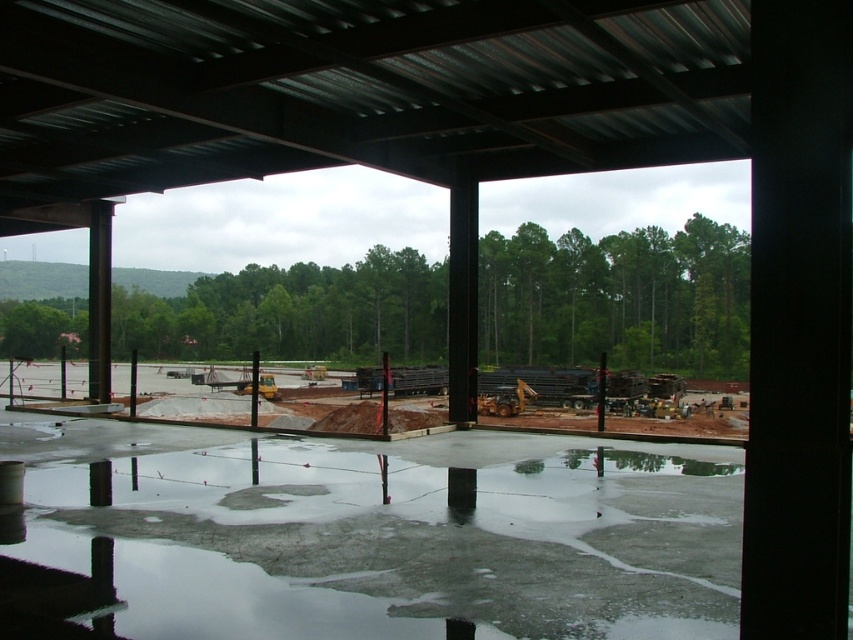
Question: Which object is closer to the camera taking this photo?

Choices:
 (A) metallic pole at left
 (B) glossy concrete flood at lower center

Answer: (B)

Question: Can you confirm if glossy concrete flood at lower center is positioned below metallic pole at left?

Choices:
 (A) no
 (B) yes

Answer: (B)

Question: Can you confirm if glossy concrete flood at lower center is positioned to the left of metallic pole at left?

Choices:
 (A) no
 (B) yes

Answer: (A)

Question: In this image, where is glossy concrete flood at lower center located relative to metallic pole at left?

Choices:
 (A) left
 (B) right

Answer: (B)